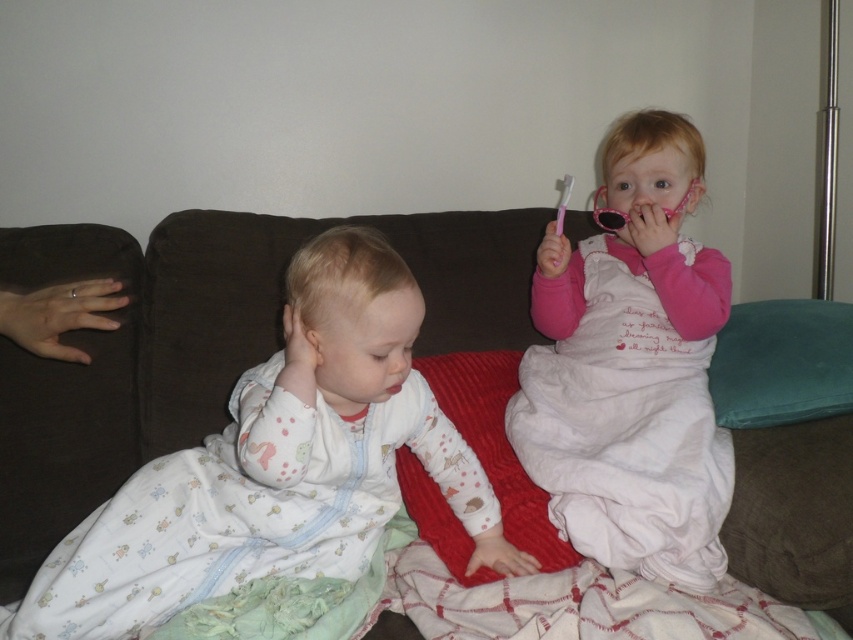
Question: Does white cotton onesie at left appear under pink matte lips at center?

Choices:
 (A) no
 (B) yes

Answer: (B)

Question: Estimate the real-world distances between objects in this image. Which object is closer to the pink matte lips at center?

Choices:
 (A) pink plastic toothbrush at upper right
 (B) white cotton onesie at left

Answer: (B)

Question: Is white cotton onesie at left wider than pink plastic toothbrush at upper right?

Choices:
 (A) no
 (B) yes

Answer: (B)

Question: Which object appears closest to the camera in this image?

Choices:
 (A) pink matte lips at center
 (B) white cotton onesie at left
 (C) pink plastic toothbrush at upper right

Answer: (B)

Question: Is white cotton onesie at left thinner than pink matte lips at center?

Choices:
 (A) no
 (B) yes

Answer: (A)

Question: Among these objects, which one is nearest to the camera?

Choices:
 (A) white cotton onesie at left
 (B) pink plastic toothbrush at upper right
 (C) pink satin dress at upper right

Answer: (A)